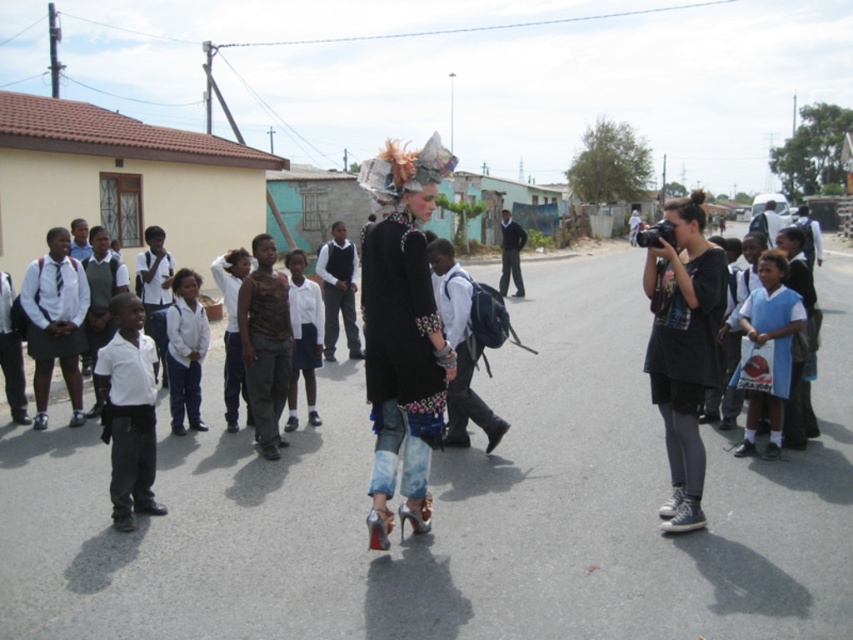
Consider the image. Is fuzzy fabric headdress at center to the right of dark gray pants at center from the viewer's perspective?

No, fuzzy fabric headdress at center is not to the right of dark gray pants at center.

From the picture: Which of these two, fuzzy fabric headdress at center or dark gray pants at center, stands taller?

With more height is dark gray pants at center.

Does point (413, 433) come behind point (509, 252)?

No, it is in front of (509, 252).

This screenshot has width=853, height=640. Find the location of `fuzzy fabric headdress at center`. fuzzy fabric headdress at center is located at coordinates (402, 333).

Between point (120, 312) and point (749, 420), which one is positioned in front?

Point (120, 312) is more forward.

Who is more distant from viewer, (103, 346) or (769, 397)?

The point (103, 346) is behind.

Locate an element on the screen. white smooth shirt at left is located at coordinates (128, 412).

Between fuzzy fabric headdress at center and dark gray sweater at center, which one appears on the right side from the viewer's perspective?

From the viewer's perspective, fuzzy fabric headdress at center appears more on the right side.

Does fuzzy fabric headdress at center appear over dark gray sweater at center?

Yes, fuzzy fabric headdress at center is above dark gray sweater at center.

The image size is (853, 640). I want to click on fuzzy fabric headdress at center, so click(x=402, y=333).

This screenshot has height=640, width=853. I want to click on fuzzy fabric headdress at center, so click(402, 333).